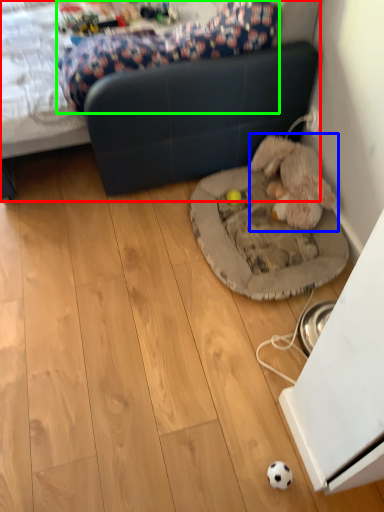
Question: Based on their relative distances, which object is nearer to studio couch (highlighted by a red box)? Choose from toy (highlighted by a blue box) and mattress (highlighted by a green box).

Choices:
 (A) toy
 (B) mattress

Answer: (B)